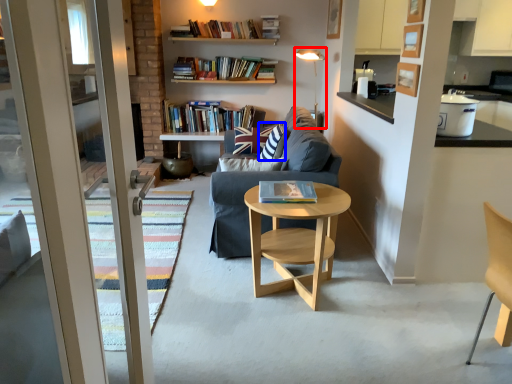
Question: Among these objects, which one is nearest to the camera, light fixture (highlighted by a red box) or pillow (highlighted by a blue box)?

Choices:
 (A) light fixture
 (B) pillow

Answer: (B)